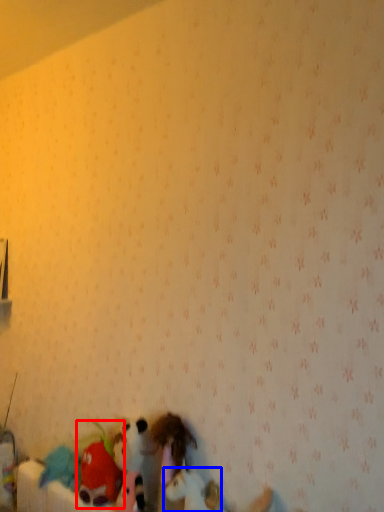
Question: Which object is closer to the camera taking this photo, toy (highlighted by a red box) or toy (highlighted by a blue box)?

Choices:
 (A) toy
 (B) toy

Answer: (B)